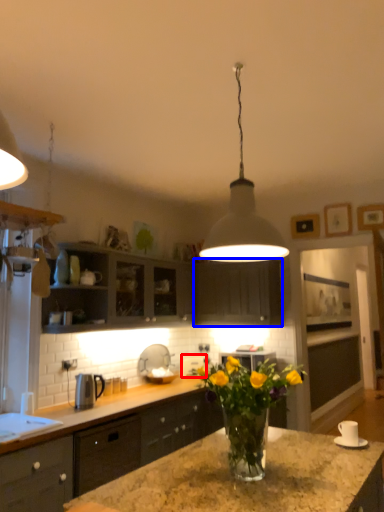
Question: Which point is further to the camera, appliance (highlighted by a red box) or cabinetry (highlighted by a blue box)?

Choices:
 (A) appliance
 (B) cabinetry

Answer: (A)